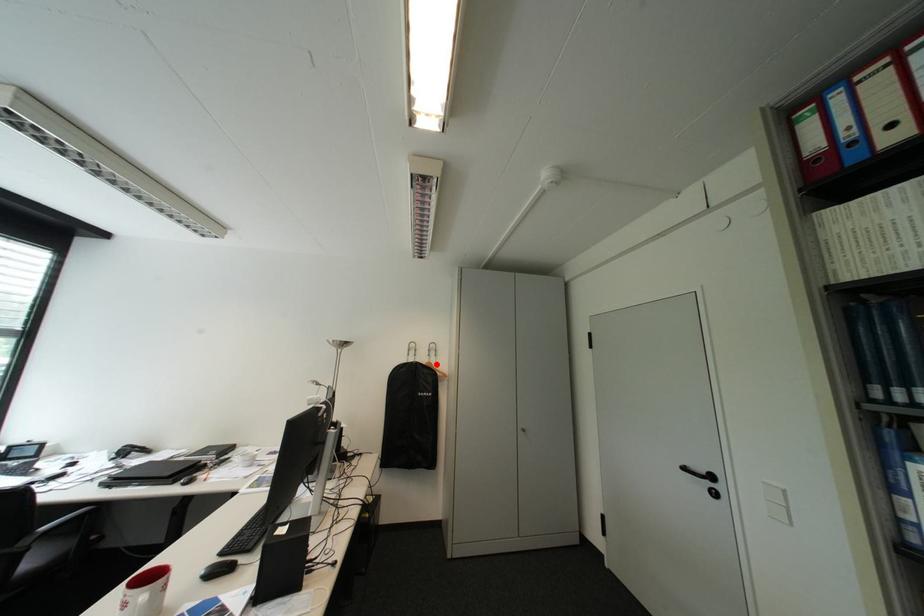
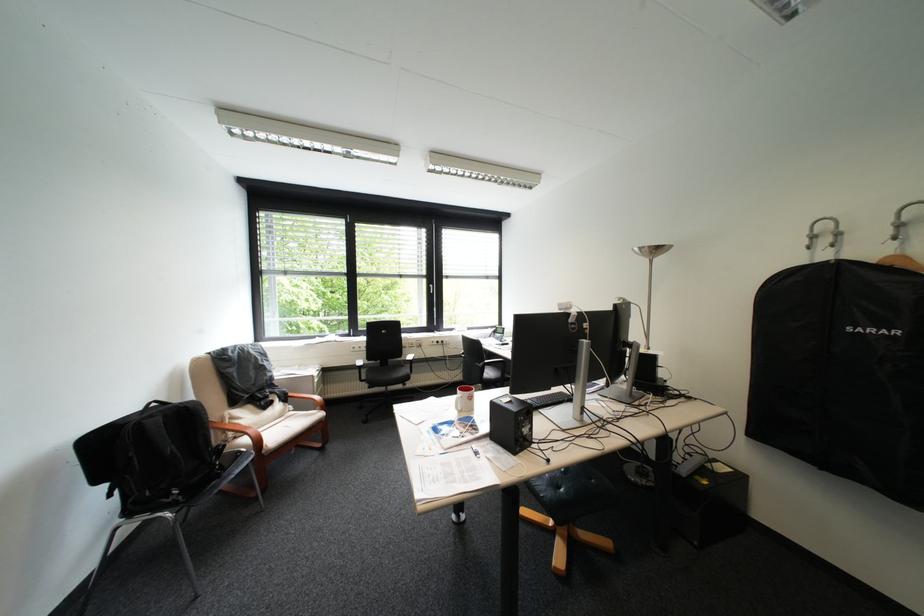
Question: I am providing you with two images of the same scene from different viewpoints. A red point is shown in image1. For the corresponding object point in image2, is it positioned nearer or farther from the camera?

Choices:
 (A) Nearer
 (B) Farther

Answer: (A)